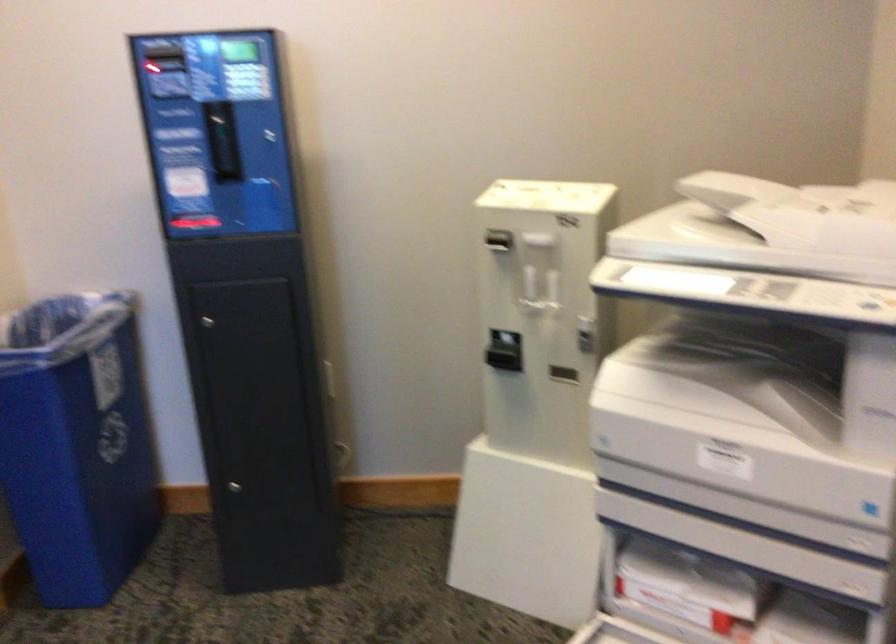
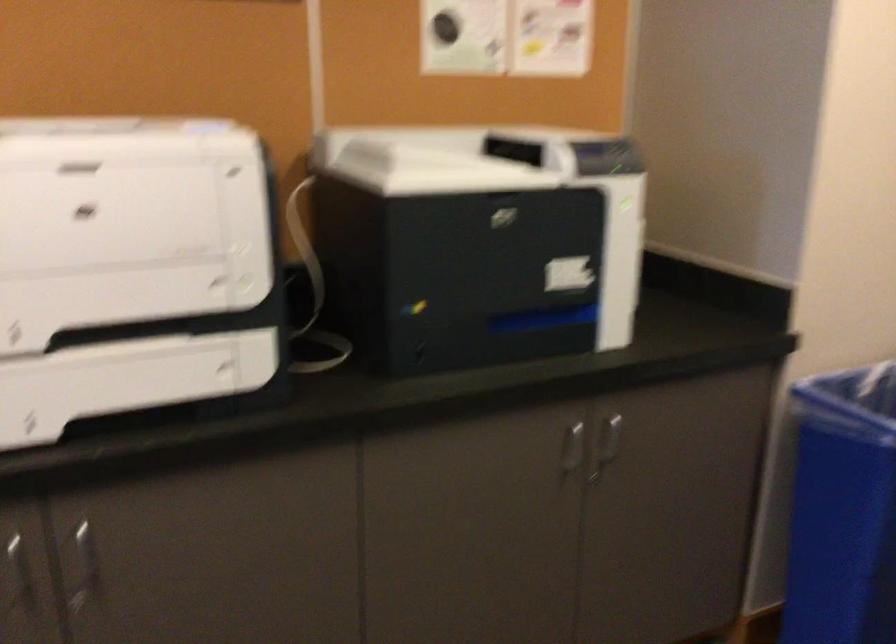
Question: How did the camera likely rotate?

Choices:
 (A) Left
 (B) Right
 (C) Up
 (D) Down

Answer: (A)